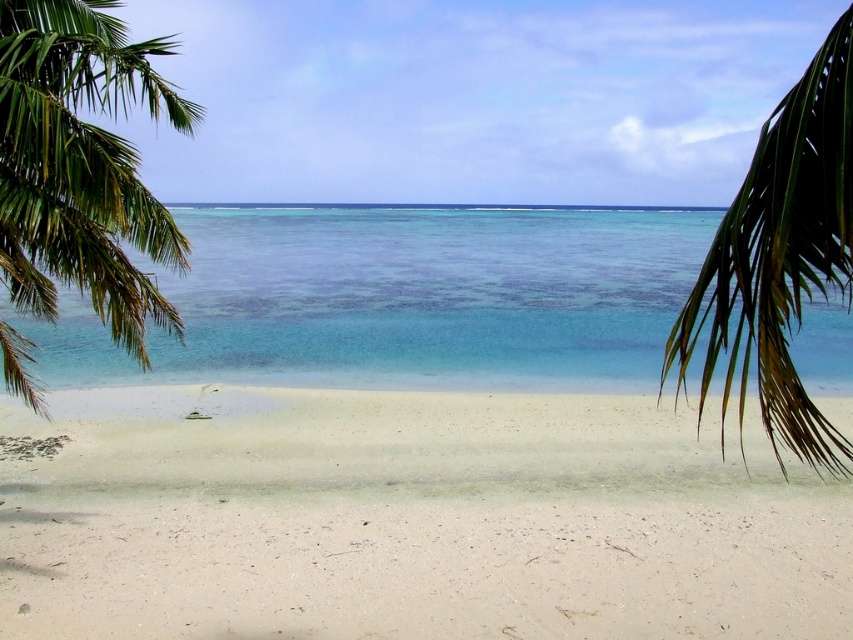
Who is more forward, (306, 579) or (3, 227)?

Point (3, 227) is in front.

Does white sandy beach at center have a smaller size compared to green leafy palm tree at left?

Indeed, white sandy beach at center has a smaller size compared to green leafy palm tree at left.

Describe the element at coordinates (409, 520) in the screenshot. I see `white sandy beach at center` at that location.

This screenshot has width=853, height=640. Find the location of `white sandy beach at center`. white sandy beach at center is located at coordinates (409, 520).

Which is more to the right, white sandy beach at center or green leafy palm at right?

Positioned to the right is green leafy palm at right.

Can you confirm if white sandy beach at center is positioned above green leafy palm at right?

Incorrect, white sandy beach at center is not positioned above green leafy palm at right.

Where is `white sandy beach at center`? The width and height of the screenshot is (853, 640). white sandy beach at center is located at coordinates (409, 520).

Who is positioned more to the left, clear blue water at center or green leafy palm tree at left?

green leafy palm tree at left

Can you confirm if clear blue water at center is positioned above green leafy palm tree at left?

Actually, clear blue water at center is below green leafy palm tree at left.

Who is more distant from viewer, (537,230) or (91,3)?

Positioned behind is point (537,230).

The image size is (853, 640). In order to click on clear blue water at center in this screenshot , I will do `click(404, 298)`.